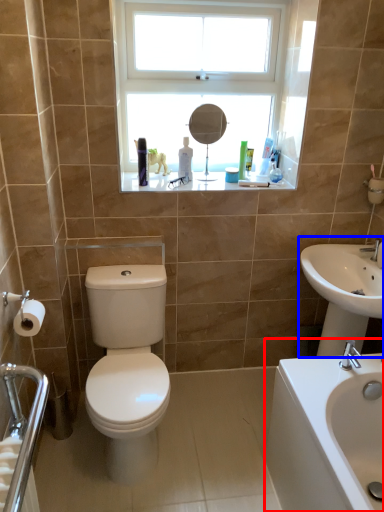
Question: Which of the following is the closest to the observer, sink (highlighted by a red box) or sink (highlighted by a blue box)?

Choices:
 (A) sink
 (B) sink

Answer: (A)